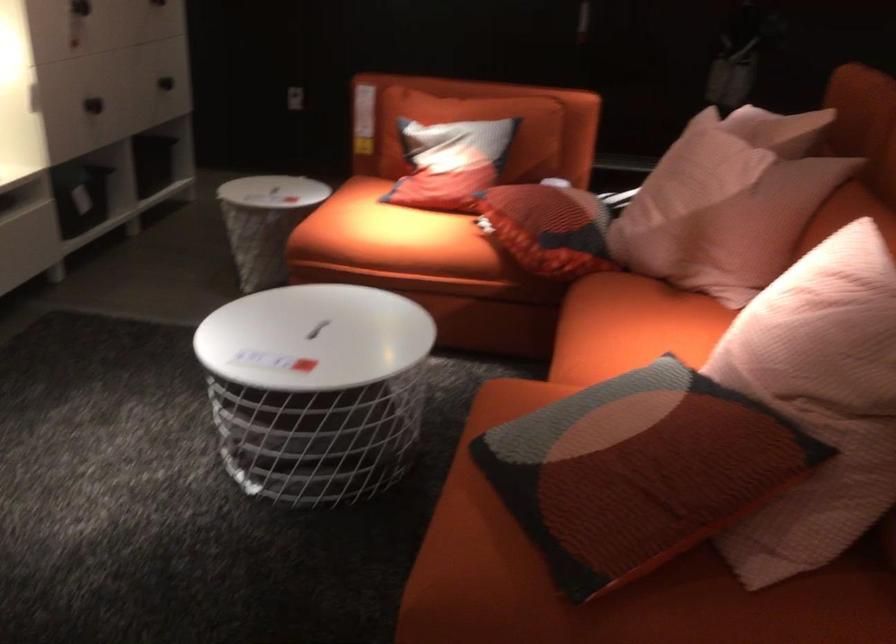
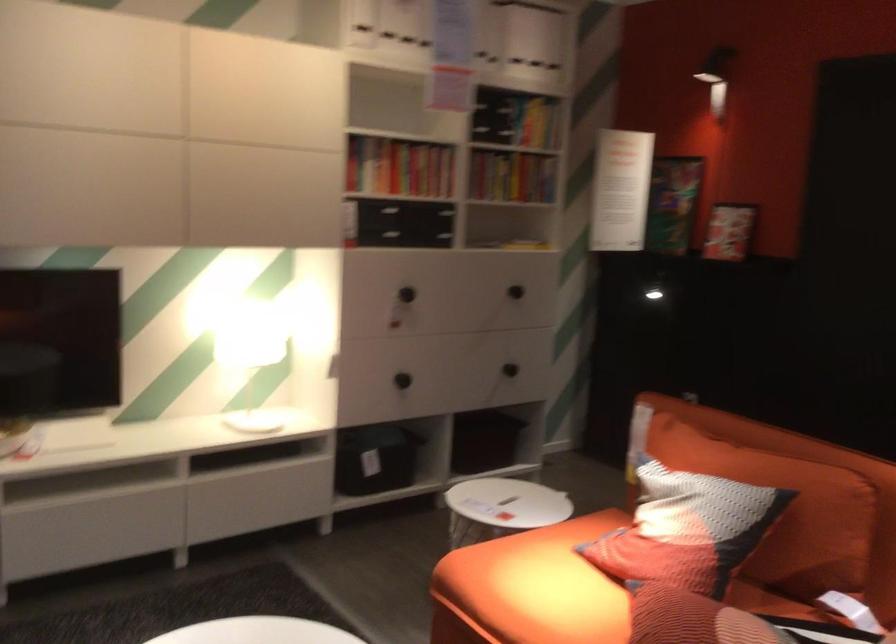
Where in the second image is the point corresponding to point 175,84 from the first image?

(510, 368)